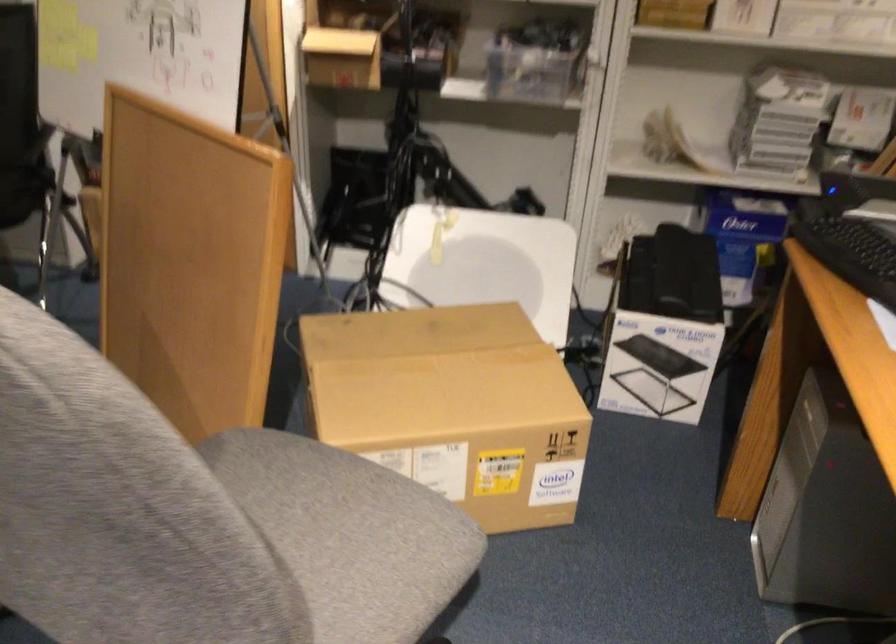
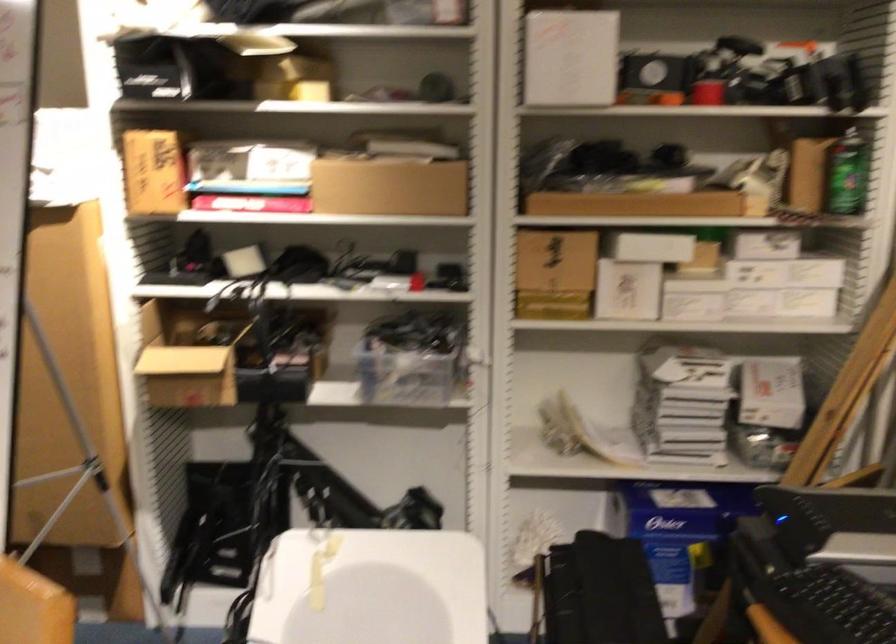
Find the pixel in the second image that matches point 483,252 in the first image.

(371, 588)